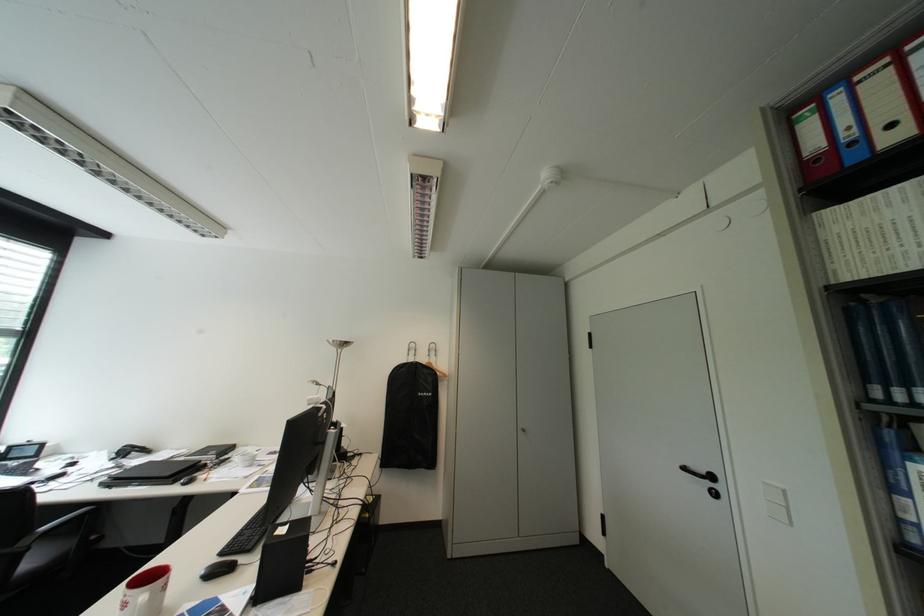
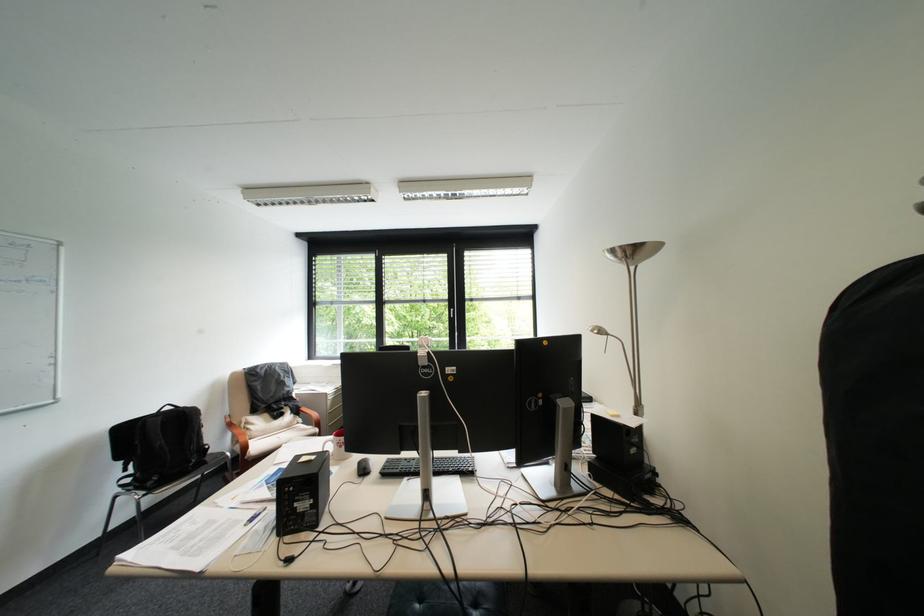
In the second image, find the point that corresponds to pixel 346 341 in the first image.

(625, 252)